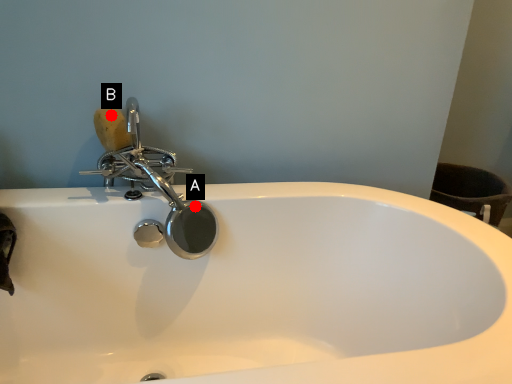
Question: Two points are circled on the image, labeled by A and B beside each circle. Which point is farther from the camera taking this photo?

Choices:
 (A) A is further
 (B) B is further

Answer: (A)